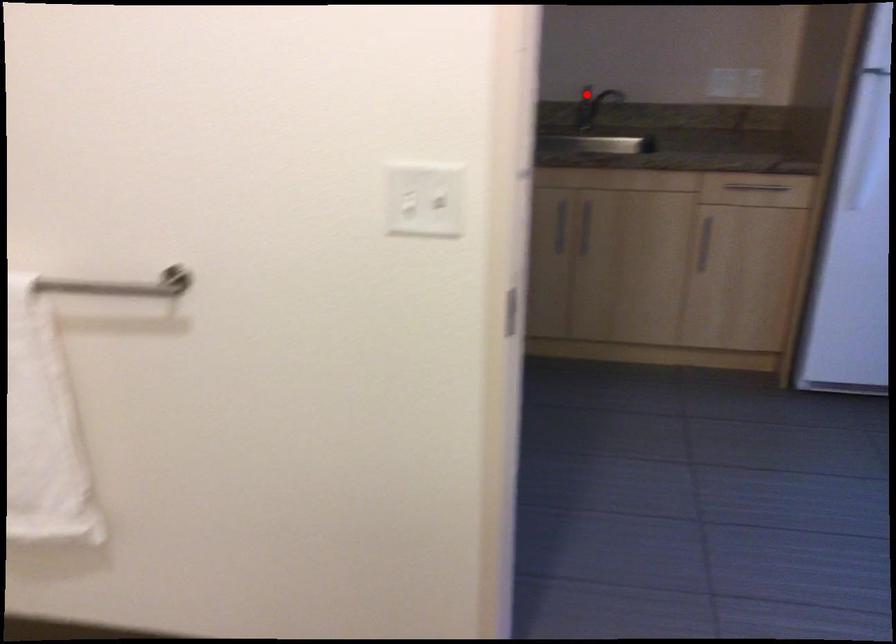
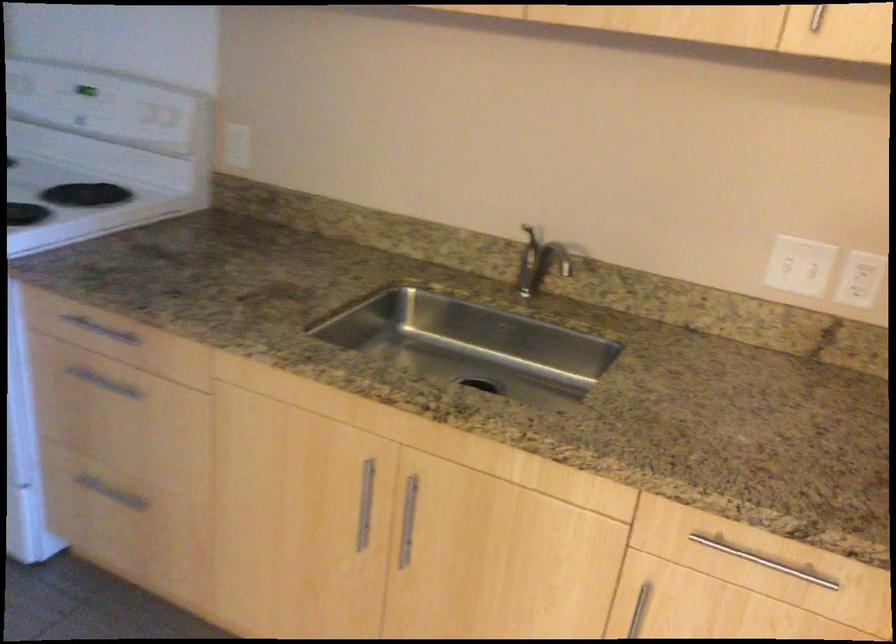
Locate, in the second image, the point that corresponds to the highlighted location in the first image.

(545, 251)